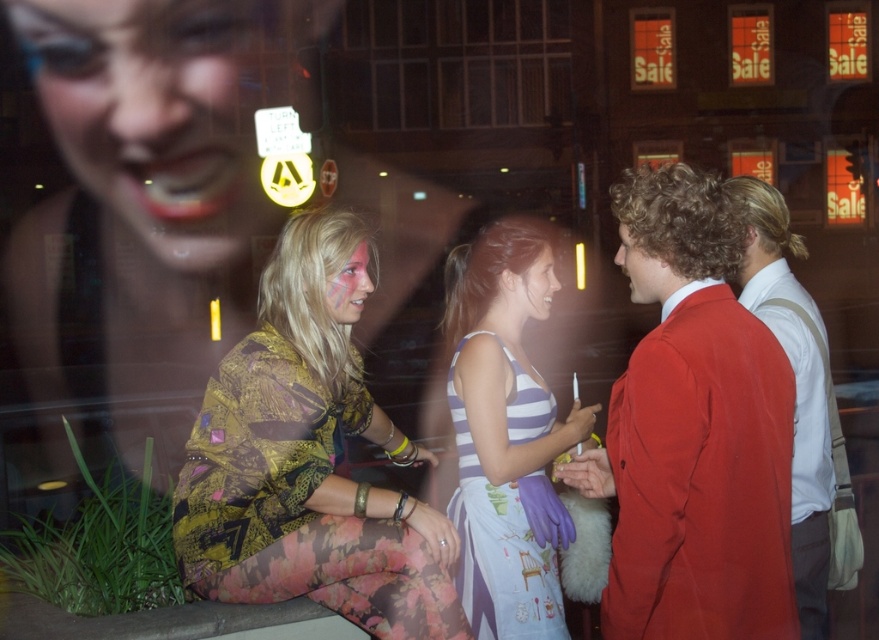
Question: Estimate the real-world distances between objects in this image. Which object is farther from the matte red suit at right?

Choices:
 (A) striped fabric dress at center
 (B) matte black face at upper left
 (C) matte pink paint at center

Answer: (B)

Question: Is matte pink paint at center wider than smooth skin face at center?

Choices:
 (A) no
 (B) yes

Answer: (A)

Question: Which of these objects is positioned closest to the smooth red jacket at right?

Choices:
 (A) matte red blazer at right
 (B) smooth skin face at center
 (C) matte pink paint at center

Answer: (B)

Question: Where is striped fabric dress at center located in relation to smooth red jacket at right in the image?

Choices:
 (A) above
 (B) below

Answer: (B)

Question: Which object is farther from the camera taking this photo?

Choices:
 (A) smooth red jacket at right
 (B) smooth skin face at center
 (C) matte pink paint at center

Answer: (B)

Question: Is floral-patterned dress at center below smooth red jacket at right?

Choices:
 (A) yes
 (B) no

Answer: (A)